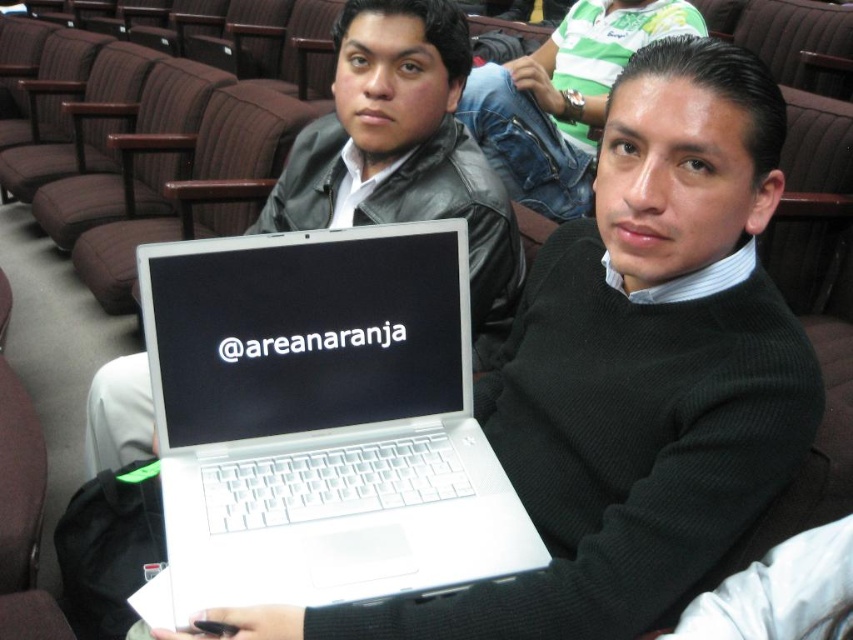
Can you confirm if white plastic laptop at center is positioned to the right of white matte laptop at center?

Indeed, white plastic laptop at center is positioned on the right side of white matte laptop at center.

Does white plastic laptop at center have a greater height compared to white matte laptop at center?

In fact, white plastic laptop at center may be shorter than white matte laptop at center.

Does point (264, 253) lie behind point (502, 273)?

That is False.

At what (x,y) coordinates should I click in order to perform the action: click on white plastic laptop at center. Please return your answer as a coordinate pair (x, y). Looking at the image, I should click on (322, 419).